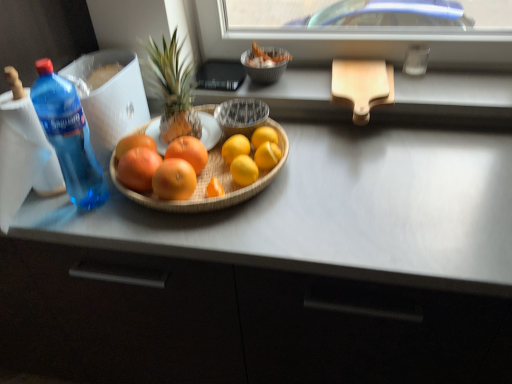
Where is `unoccupied region to the right of metallic silver bowl at upper center`? The width and height of the screenshot is (512, 384). unoccupied region to the right of metallic silver bowl at upper center is located at coordinates (310, 81).